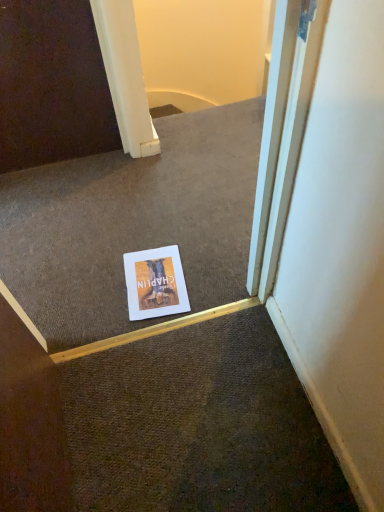
This screenshot has width=384, height=512. Identify the location of vacant area that lies to the right of white paper at center. point(210,271).